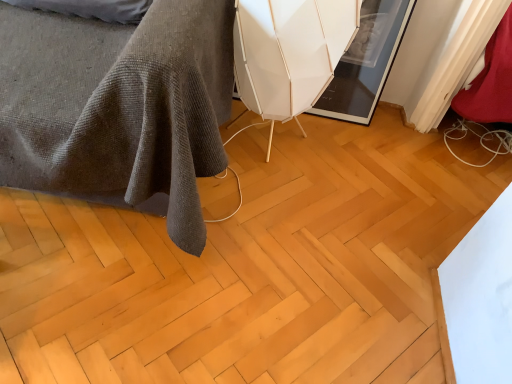
Where is `dark gray textured blanket at lower left`? dark gray textured blanket at lower left is located at coordinates (119, 107).

What do you see at coordinates (289, 53) in the screenshot? This screenshot has height=384, width=512. I see `white matte swivel chair at center` at bounding box center [289, 53].

The height and width of the screenshot is (384, 512). Identify the location of natural wood floor at center. (250, 268).

In terms of height, does dark gray textured blanket at lower left look taller or shorter compared to white matte swivel chair at center?

In the image, dark gray textured blanket at lower left appears to be taller than white matte swivel chair at center.

Which point is more distant from viewer, [118,181] or [265,9]?

Point [118,181]

Is dark gray textured blanket at lower left spatially inside white matte swivel chair at center, or outside of it?

dark gray textured blanket at lower left is not enclosed by white matte swivel chair at center.

From the image's perspective, between dark gray textured blanket at lower left and white matte swivel chair at center, who is located below?

From the image's view, white matte swivel chair at center is below.

Between dark gray textured blanket at lower left and natural wood floor at center, which one has larger size?

Bigger between the two is dark gray textured blanket at lower left.

Does dark gray textured blanket at lower left have a lesser height compared to natural wood floor at center?

No.

Does dark gray textured blanket at lower left touch natural wood floor at center?

dark gray textured blanket at lower left and natural wood floor at center are clearly separated.

Measure the distance from dark gray textured blanket at lower left to natural wood floor at center.

They are 17.73 inches apart.

From a real-world perspective, who is located lower, natural wood floor at center or white matte swivel chair at center?

natural wood floor at center, from a real-world perspective.

Considering the positions of point (481, 212) and point (243, 75), is point (481, 212) closer or farther from the camera than point (243, 75)?

Point (481, 212) is positioned farther from the camera compared to point (243, 75).

Would you consider natural wood floor at center to be distant from white matte swivel chair at center?

That's not correct — natural wood floor at center is a little close to white matte swivel chair at center.

From the image's perspective, is natural wood floor at center above or below white matte swivel chair at center?

Based on their image positions, natural wood floor at center is located beneath white matte swivel chair at center.

In the scene shown: Can we say natural wood floor at center lies outside dark gray textured blanket at lower left?

Indeed, natural wood floor at center is completely outside dark gray textured blanket at lower left.

From a real-world perspective, relative to dark gray textured blanket at lower left, is natural wood floor at center vertically above or below?

natural wood floor at center is situated lower than dark gray textured blanket at lower left in the real world.

Considering the relative sizes of natural wood floor at center and dark gray textured blanket at lower left in the image provided, is natural wood floor at center thinner than dark gray textured blanket at lower left?

No.

Is white matte swivel chair at center not within natural wood floor at center?

white matte swivel chair at center is positioned outside natural wood floor at center.

Who is shorter, white matte swivel chair at center or natural wood floor at center?

natural wood floor at center is shorter.

Based on the photo, considering the sizes of objects white matte swivel chair at center and natural wood floor at center in the image provided, who is smaller, white matte swivel chair at center or natural wood floor at center?

Smaller between the two is natural wood floor at center.

Is white matte swivel chair at center facing towards dark gray textured blanket at lower left?

No, white matte swivel chair at center is not oriented towards dark gray textured blanket at lower left.

Does point (274, 112) appear closer or farther from the camera than point (66, 193)?

Point (274, 112) is farther from the camera than point (66, 193).

Considering the relative positions of white matte swivel chair at center and dark gray textured blanket at lower left in the image provided, is white matte swivel chair at center behind dark gray textured blanket at lower left?

Yes, it is.

Identify the location of swivel chair below the dark gray textured blanket at lower left (from the image's perspective). (289, 53).

This screenshot has height=384, width=512. Identify the location of furniture above the natural wood floor at center (from the image's perspective). (119, 107).

When comparing their distances from white matte swivel chair at center, does dark gray textured blanket at lower left or natural wood floor at center seem further?

natural wood floor at center is positioned further to the anchor white matte swivel chair at center.

When comparing their distances from dark gray textured blanket at lower left, does natural wood floor at center or white matte swivel chair at center seem closer?

white matte swivel chair at center is positioned closer to the anchor dark gray textured blanket at lower left.

Based on their spatial positions, is white matte swivel chair at center or natural wood floor at center further from dark gray textured blanket at lower left?

natural wood floor at center is positioned further to the anchor dark gray textured blanket at lower left.

Considering their positions, is natural wood floor at center positioned closer to white matte swivel chair at center than dark gray textured blanket at lower left?

Result: dark gray textured blanket at lower left.

When comparing their distances from natural wood floor at center, does white matte swivel chair at center or dark gray textured blanket at lower left seem closer?

Based on the image, dark gray textured blanket at lower left appears to be nearer to natural wood floor at center.

When comparing their distances from natural wood floor at center, does dark gray textured blanket at lower left or white matte swivel chair at center seem further?

Based on the image, white matte swivel chair at center appears to be further to natural wood floor at center.

This screenshot has height=384, width=512. Find the location of `plywood between dark gray textured blanket at lower left and white matte swivel chair at center from left to right`. plywood between dark gray textured blanket at lower left and white matte swivel chair at center from left to right is located at coordinates (250, 268).